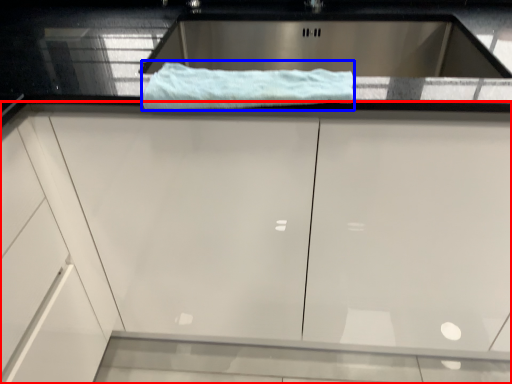
Question: Among these objects, which one is nearest to the camera, cabinetry (highlighted by a red box) or bath towel (highlighted by a blue box)?

Choices:
 (A) cabinetry
 (B) bath towel

Answer: (A)